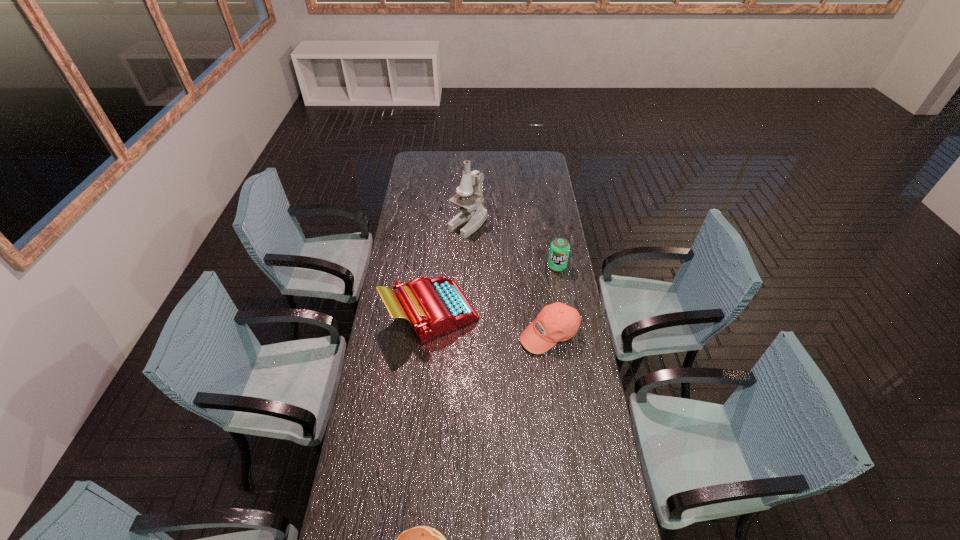
Find the location of a particular element. empty location between the microscope and the baseball cap is located at coordinates (509, 279).

Identify the location of object that ranks as the third closest to the baseball cap. (473, 213).

Locate which object ranks third in proximity to the baseball cap. Please provide its 2D coordinates. Your answer should be formatted as a tuple, i.e. [(x, y)], where the tuple contains the x and y coordinates of a point satisfying the conditions above.

[(473, 213)]

Where is `free location that satisfies the following two spatial constraints: 1. on the typing side of the second tallest object; 2. on the back side of the baseball cap`? The image size is (960, 540). free location that satisfies the following two spatial constraints: 1. on the typing side of the second tallest object; 2. on the back side of the baseball cap is located at coordinates (429, 333).

Find the location of a particular element. The height and width of the screenshot is (540, 960). vacant space that satisfies the following two spatial constraints: 1. on the front-facing side of the second farthest object; 2. on the typing side of the second tallest object is located at coordinates pyautogui.click(x=565, y=314).

I want to click on vacant space that satisfies the following two spatial constraints: 1. on the typing side of the baseball cap; 2. on the right side of the second tallest object, so tap(429, 333).